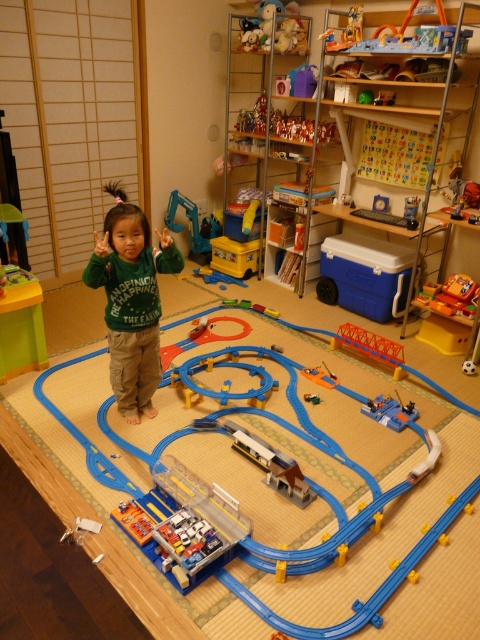
Is green fleece sweater at center wider than orange plastic train at center?

Yes.

Which of these two, green fleece sweater at center or orange plastic train at center, stands shorter?

orange plastic train at center

Where is `green fleece sweater at center`? The height and width of the screenshot is (640, 480). green fleece sweater at center is located at coordinates (132, 300).

Where is `green fleece sweater at center`? This screenshot has width=480, height=640. green fleece sweater at center is located at coordinates (132, 300).

Who is more forward, (241, 406) or (288, 477)?

Positioned in front is point (288, 477).

Does blue plastic train at center lie behind wooden train at center?

No, it is in front of wooden train at center.

Is point (116, 465) positioned after point (268, 476)?

That is True.

The height and width of the screenshot is (640, 480). Identify the location of blue plastic train at center. (356, 602).

Based on the photo, does blue plastic train at center appear on the left side of orange plastic train at center?

Indeed, blue plastic train at center is positioned on the left side of orange plastic train at center.

Where is `blue plastic train at center`? This screenshot has height=640, width=480. blue plastic train at center is located at coordinates 356,602.

Where is `blue plastic train at center`? The image size is (480, 640). blue plastic train at center is located at coordinates (356, 602).